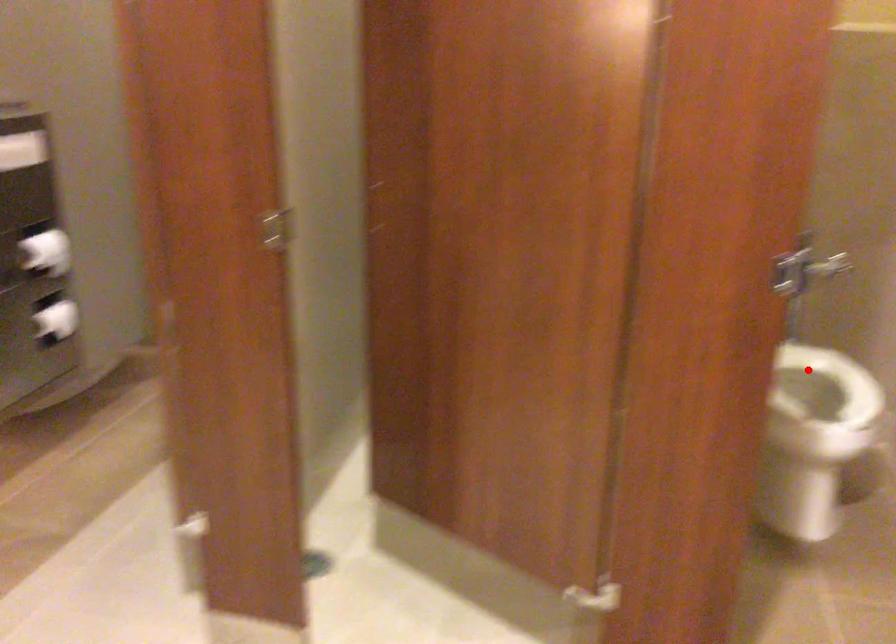
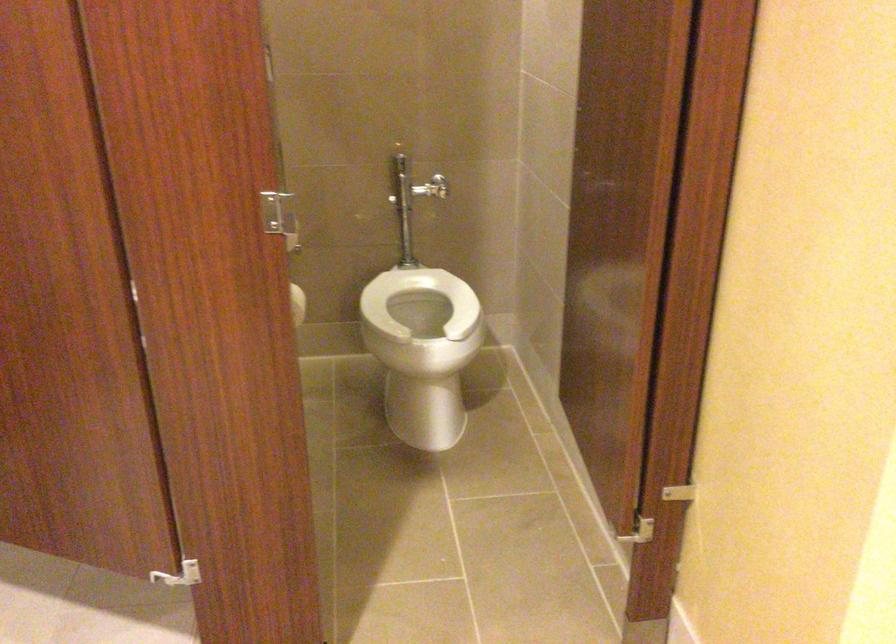
Question: I am providing you with two images of the same scene from different viewpoints. Image1 has a red point marked. In image2, the corresponding 3D location appears at what relative position? Reply with the corresponding letter.

Choices:
 (A) Closer
 (B) Farther

Answer: (B)